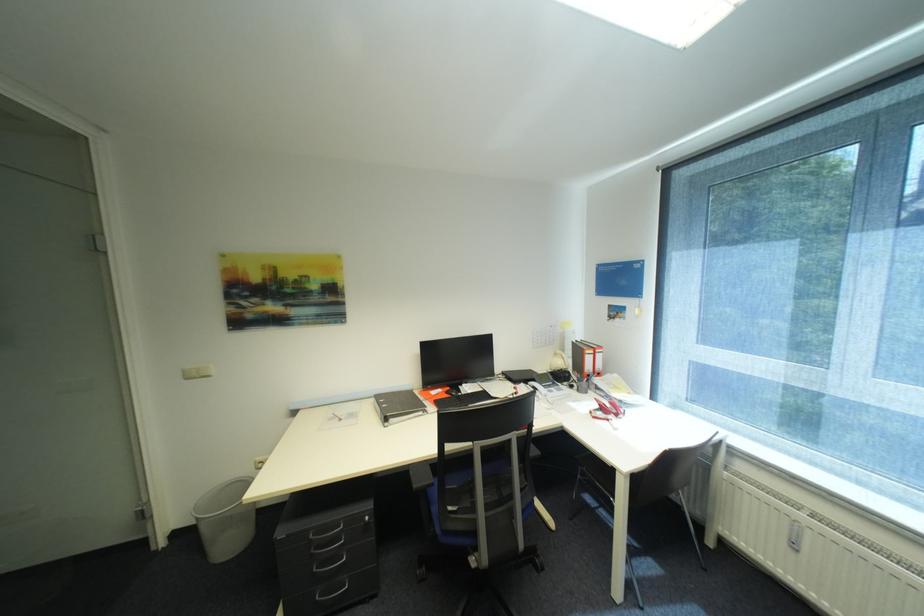
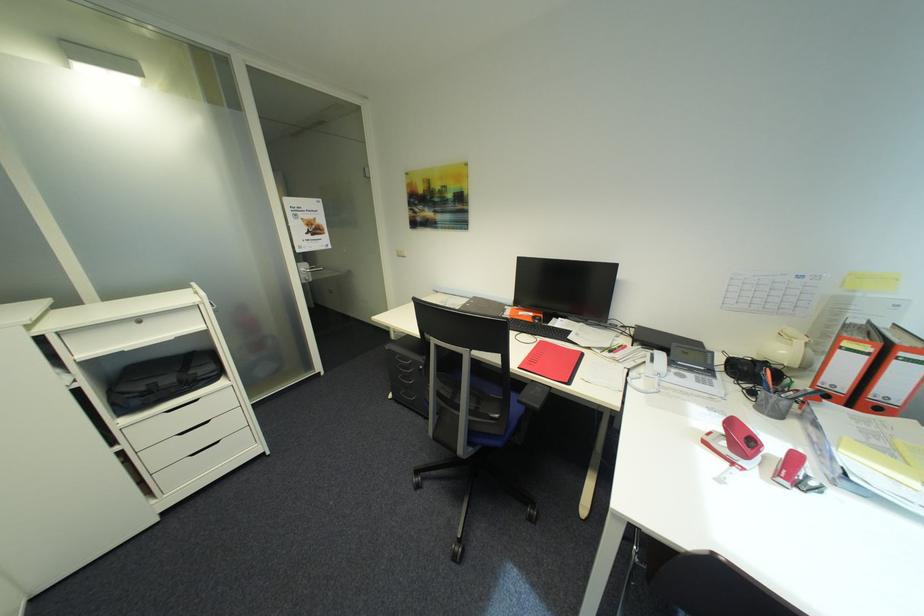
Find the pixel in the second image that matches the point at 606,358 in the first image.

(912, 371)